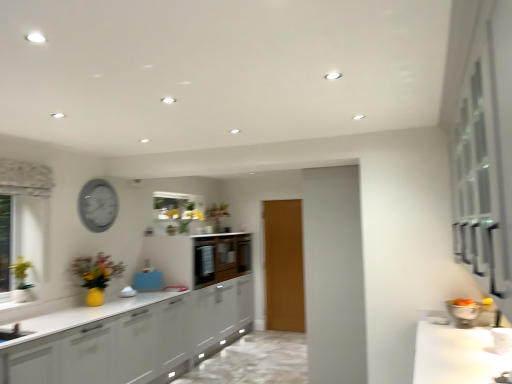
Question: Is white glossy countertop at lower right taller than matte gray clock at upper left?

Choices:
 (A) yes
 (B) no

Answer: (B)

Question: Is matte gray clock at upper left inside white glossy countertop at lower right?

Choices:
 (A) yes
 (B) no

Answer: (B)

Question: Is white glossy countertop at lower right aimed at matte gray clock at upper left?

Choices:
 (A) no
 (B) yes

Answer: (A)

Question: Does white glossy countertop at lower right come in front of matte gray clock at upper left?

Choices:
 (A) yes
 (B) no

Answer: (A)

Question: From the image's perspective, does white glossy countertop at lower right appear higher than matte gray clock at upper left?

Choices:
 (A) no
 (B) yes

Answer: (A)

Question: Is point (19, 264) closer or farther from the camera than point (284, 291)?

Choices:
 (A) closer
 (B) farther

Answer: (A)

Question: From a real-world perspective, is matte white vase at left, the first floral arrangement from the bottom, physically located above or below wooden door at center?

Choices:
 (A) below
 (B) above

Answer: (B)

Question: Looking at the image, does matte white vase at left, which is the 1th floral arrangement from left to right, seem bigger or smaller compared to wooden door at center?

Choices:
 (A) big
 (B) small

Answer: (B)

Question: Is matte white vase at left, the second floral arrangement in the back-to-front sequence, inside or outside of wooden door at center?

Choices:
 (A) inside
 (B) outside

Answer: (B)

Question: Choose the correct answer: Is matte brown cabinetry at center inside wooden door at center or outside it?

Choices:
 (A) outside
 (B) inside

Answer: (A)

Question: From the image's perspective, is matte brown cabinetry at center positioned above or below wooden door at center?

Choices:
 (A) below
 (B) above

Answer: (B)

Question: Relative to wooden door at center, is matte brown cabinetry at center in front or behind?

Choices:
 (A) front
 (B) behind

Answer: (A)

Question: From a real-world perspective, is matte brown cabinetry at center positioned above or below wooden door at center?

Choices:
 (A) below
 (B) above

Answer: (B)

Question: From the image's perspective, is yellow matte floral arrangement at center, arranged as the first floral arrangement when viewed from the back, above or below matte gray clock at upper left?

Choices:
 (A) below
 (B) above

Answer: (A)

Question: Based on their positions, is yellow matte floral arrangement at center, acting as the 1th floral arrangement starting from the right, located to the left or right of matte gray clock at upper left?

Choices:
 (A) left
 (B) right

Answer: (B)